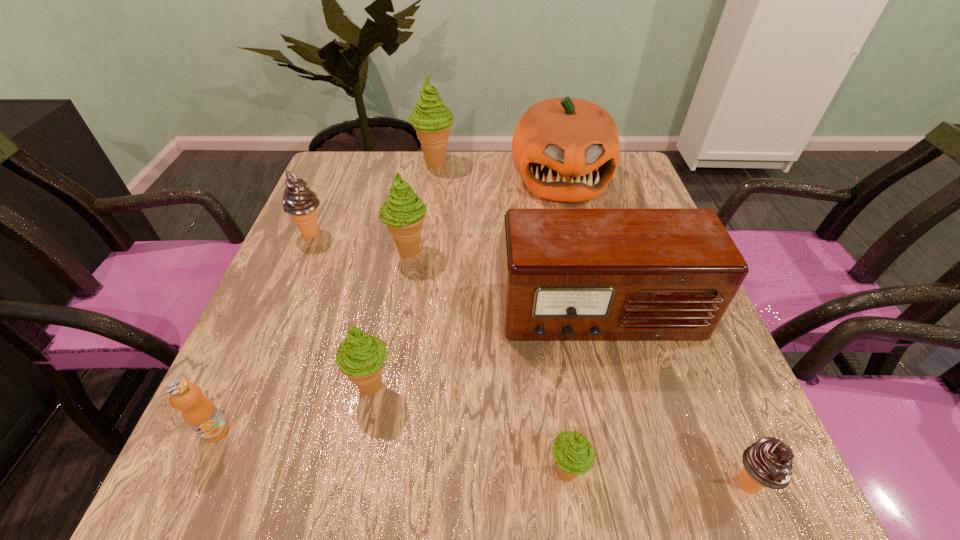
This screenshot has width=960, height=540. I want to click on free spot between the bigger chocolate icecream and the third biggest green icecream, so click(341, 309).

Identify the location of vacant space in between the farthest icecream and the farther chocolate icecream. The image size is (960, 540). (372, 198).

Where is `empty location between the tallest icecream and the sixth farthest object`? Image resolution: width=960 pixels, height=540 pixels. empty location between the tallest icecream and the sixth farthest object is located at coordinates (403, 274).

Image resolution: width=960 pixels, height=540 pixels. What are the coordinates of `free spot between the second biggest green icecream and the second smallest green icecream` in the screenshot? It's located at (390, 318).

At what (x,y) coordinates should I click in order to perform the action: click on blank region between the left chocolate icecream and the third biggest green icecream. Please return your answer as a coordinate pair (x, y). Looking at the image, I should click on (341, 309).

Identify the location of object that can be found as the fifth closest to the pumpkin. (360, 357).

I want to click on object that is the third closest to the fourth farthest icecream, so click(403, 212).

Select which icecream appears as the second closest to the fifth icecream from left to right. Please provide its 2D coordinates. Your answer should be formatted as a tuple, i.e. [(x, y)], where the tuple contains the x and y coordinates of a point satisfying the conditions above.

[(360, 357)]

Select which icecream is the third closest to the rightmost icecream. Please provide its 2D coordinates. Your answer should be formatted as a tuple, i.e. [(x, y)], where the tuple contains the x and y coordinates of a point satisfying the conditions above.

[(403, 212)]

Locate an element on the screen. This screenshot has width=960, height=540. the second closest green icecream relative to the third nearest icecream is located at coordinates (573, 454).